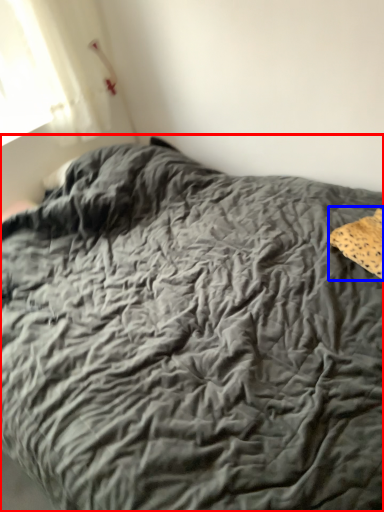
Question: Which object is further to the camera taking this photo, bed (highlighted by a red box) or material (highlighted by a blue box)?

Choices:
 (A) bed
 (B) material

Answer: (B)